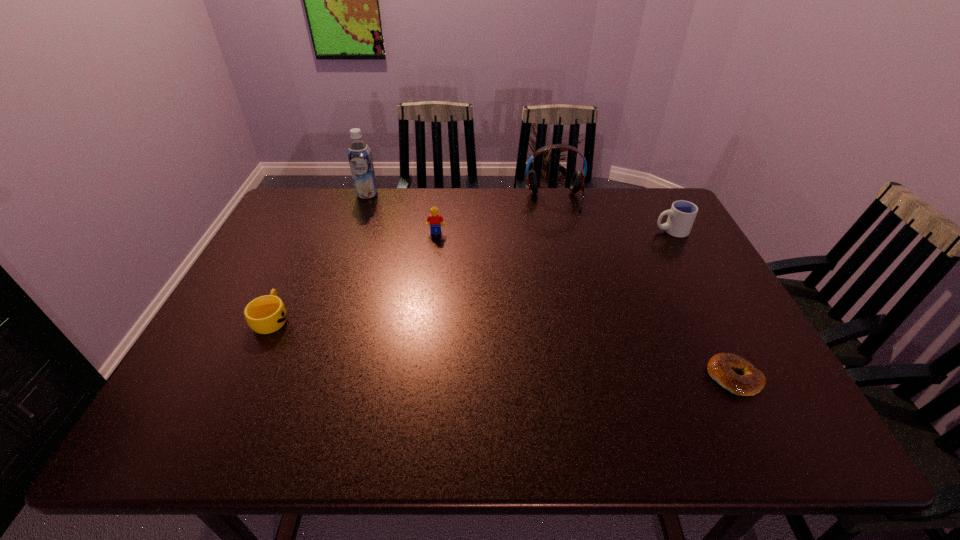
The image size is (960, 540). Identify the location of vacant space at the near right corner of the desktop. (736, 414).

This screenshot has width=960, height=540. In order to click on unoccupied position between the second tallest object and the bagel in this screenshot , I will do `click(644, 288)`.

You are a GUI agent. You are given a task and a screenshot of the screen. Output one action in this format:
    pyautogui.click(x=<x>, y=<y>)
    Task: Click on the free space between the farther cup and the left cup
    The image size is (960, 540).
    Given the screenshot: What is the action you would take?
    pyautogui.click(x=471, y=275)

You are a GUI agent. You are given a task and a screenshot of the screen. Output one action in this format:
    pyautogui.click(x=<x>, y=<y>)
    Task: Click on the vacant space that's between the fifth farthest object and the Lego
    The image size is (960, 540).
    Given the screenshot: What is the action you would take?
    pyautogui.click(x=354, y=275)

At what (x,y) coordinates should I click in order to perform the action: click on free point between the farther cup and the second tallest object. Please return your answer as a coordinate pair (x, y). This screenshot has height=540, width=960. Looking at the image, I should click on pyautogui.click(x=613, y=215).

At what (x,y) coordinates should I click in order to perform the action: click on blank region between the second shortest object and the fourth object from left to right. Please return your answer as a coordinate pair (x, y). Looking at the image, I should click on (414, 259).

This screenshot has height=540, width=960. What are the coordinates of `free spot between the left cup and the nearest object` in the screenshot? It's located at (503, 348).

At what (x,y) coordinates should I click in order to perform the action: click on blank region between the fourth object from left to right and the farther cup. Please return your answer as a coordinate pair (x, y). The height and width of the screenshot is (540, 960). Looking at the image, I should click on (613, 215).

You are a GUI agent. You are given a task and a screenshot of the screen. Output one action in this format:
    pyautogui.click(x=<x>, y=<y>)
    Task: Click on the unoccupied area between the right cup and the Lego
    This screenshot has width=960, height=540.
    Given the screenshot: What is the action you would take?
    pyautogui.click(x=554, y=232)

Locate an element on the screen. free point between the second object from left to right and the nearest object is located at coordinates (551, 286).